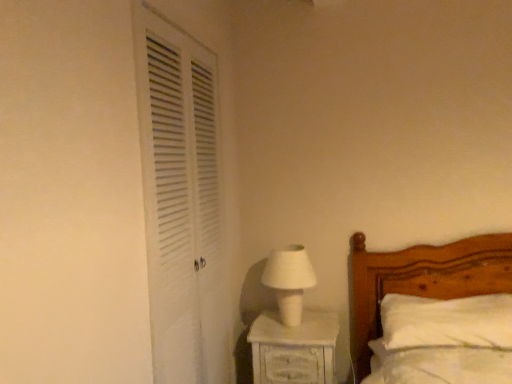
Question: Does white painted wood nightstand at lower right have a lesser height compared to white louvered door at left?

Choices:
 (A) no
 (B) yes

Answer: (B)

Question: Is white painted wood nightstand at lower right aimed at white louvered door at left?

Choices:
 (A) yes
 (B) no

Answer: (B)

Question: Does white painted wood nightstand at lower right have a lesser width compared to white louvered door at left?

Choices:
 (A) yes
 (B) no

Answer: (B)

Question: Is white painted wood nightstand at lower right closer to camera compared to white louvered door at left?

Choices:
 (A) yes
 (B) no

Answer: (B)

Question: From a real-world perspective, does white painted wood nightstand at lower right stand above white louvered door at left?

Choices:
 (A) no
 (B) yes

Answer: (A)

Question: Considering the positions of point (392, 304) and point (214, 147), is point (392, 304) closer or farther from the camera than point (214, 147)?

Choices:
 (A) closer
 (B) farther

Answer: (B)

Question: Considering the positions of white soft pillow at lower right and white louvered door at left in the image, is white soft pillow at lower right taller or shorter than white louvered door at left?

Choices:
 (A) short
 (B) tall

Answer: (A)

Question: From the image's perspective, is white soft pillow at lower right above or below white louvered door at left?

Choices:
 (A) above
 (B) below

Answer: (B)

Question: Based on their sizes in the image, would you say white soft pillow at lower right is bigger or smaller than white louvered door at left?

Choices:
 (A) big
 (B) small

Answer: (B)

Question: Based on their positions, is white matte table lamp at center located to the left or right of white louvered door at left?

Choices:
 (A) left
 (B) right

Answer: (B)

Question: Considering the positions of point (270, 273) and point (205, 367), is point (270, 273) closer or farther from the camera than point (205, 367)?

Choices:
 (A) farther
 (B) closer

Answer: (A)

Question: In the image, is white matte table lamp at center positioned in front of or behind white louvered door at left?

Choices:
 (A) behind
 (B) front

Answer: (A)

Question: Looking at their shapes, would you say white matte table lamp at center is wider or thinner than white louvered door at left?

Choices:
 (A) thin
 (B) wide

Answer: (B)

Question: Is white soft pillow at lower right spatially inside white painted wood nightstand at lower right, or outside of it?

Choices:
 (A) inside
 (B) outside

Answer: (B)

Question: From a real-world perspective, is white soft pillow at lower right above or below white painted wood nightstand at lower right?

Choices:
 (A) above
 (B) below

Answer: (A)